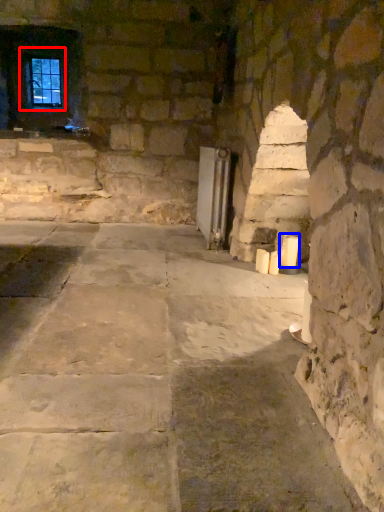
Question: Which of the following is the closest to the observer, window (highlighted by a red box) or candle (highlighted by a blue box)?

Choices:
 (A) window
 (B) candle

Answer: (B)